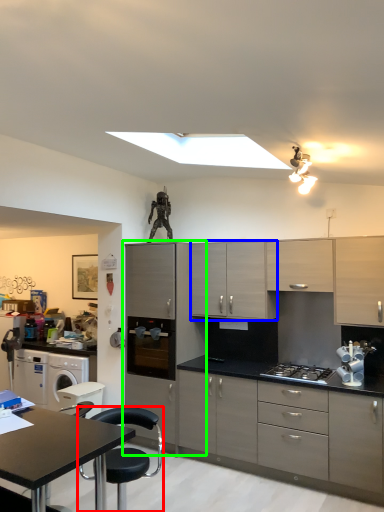
Question: Which is farther away from chair (highlighted by a red box)? cabinetry (highlighted by a blue box) or cabinetry (highlighted by a green box)?

Choices:
 (A) cabinetry
 (B) cabinetry

Answer: (A)